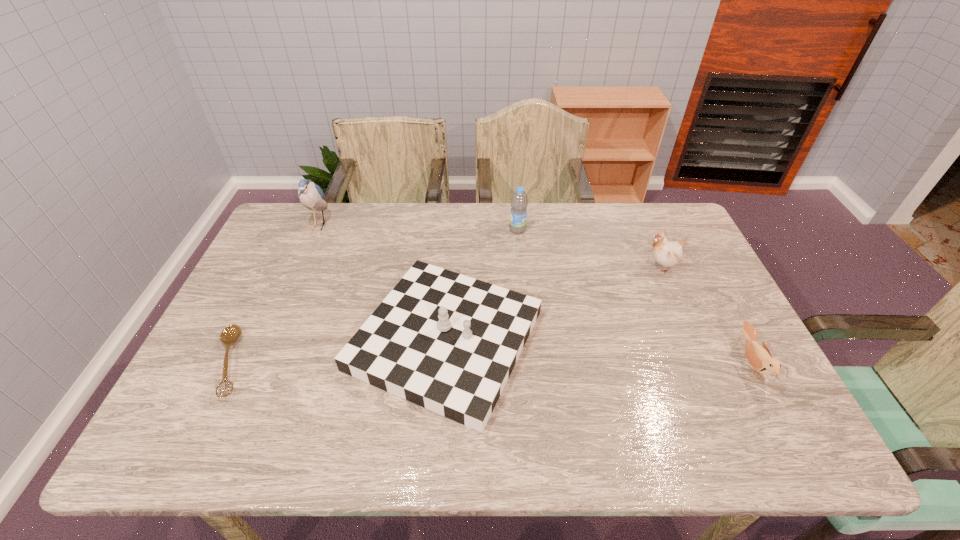
Choose which bird is the second nearest neighbor to the ladle. Please provide its 2D coordinates. Your answer should be formatted as a tuple, i.e. [(x, y)], where the tuple contains the x and y coordinates of a point satisfying the conditions above.

[(667, 253)]

You are a GUI agent. You are given a task and a screenshot of the screen. Output one action in this format:
    pyautogui.click(x=<x>, y=<y>)
    Task: Click on the vacant region that satisfies the following two spatial constraints: 1. at the tip of the leftmost bird's beak; 2. on the back side of the checkerboard
    This screenshot has height=540, width=960.
    Given the screenshot: What is the action you would take?
    pyautogui.click(x=269, y=340)

This screenshot has height=540, width=960. I want to click on vacant space that satisfies the following two spatial constraints: 1. on the back side of the shortest object; 2. on the right side of the fifth shortest object, so click(x=295, y=230).

The width and height of the screenshot is (960, 540). Find the location of `free space that satisfies the following two spatial constraints: 1. at the tip of the tallest bird's beak; 2. on the right side of the checkerboard`. free space that satisfies the following two spatial constraints: 1. at the tip of the tallest bird's beak; 2. on the right side of the checkerboard is located at coordinates (269, 340).

Identify the location of free spot that satisfies the following two spatial constraints: 1. at the tip of the checkerboard's beak; 2. on the left side of the leftmost bird. (269, 340).

The height and width of the screenshot is (540, 960). I want to click on free region that satisfies the following two spatial constraints: 1. at the tip of the water bottle's beak; 2. on the right side of the farthest bird, so click(317, 230).